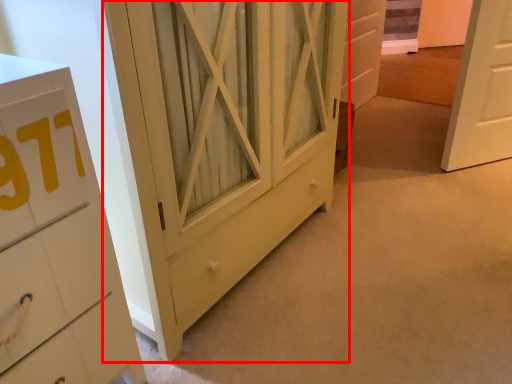
Question: From the image, what is the correct spatial relationship of barn door (annotated by the red box) in relation to door?

Choices:
 (A) left
 (B) right

Answer: (A)